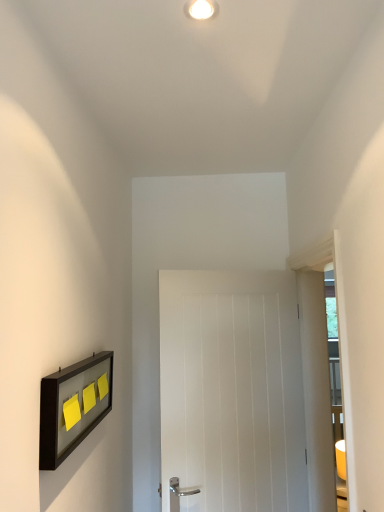
Measure the distance between point (198, 17) and camera.

They are 1.12 meters apart.

In order to face transparent glass door at right, should I rotate leftwards or rightwards?

To align with it, rotate right about 18.613°.

In order to face yellow matte/light switch at left, which is the 2th light switch in front-to-back order, should I rotate leftwards or rightwards?

You should look left and rotate roughly 13.251 degrees.

Where is `yellow matte/light switch at left, which is the 2th light switch in front-to-back order`? The height and width of the screenshot is (512, 384). yellow matte/light switch at left, which is the 2th light switch in front-to-back order is located at coordinates (89, 398).

Where is `white glossy light fixture at upper center`? The height and width of the screenshot is (512, 384). white glossy light fixture at upper center is located at coordinates (201, 9).

From the image's perspective, does transparent glass door at right appear higher than yellow matte paper at left, acting as the 2th light switch starting from the back?

Actually, transparent glass door at right appears below yellow matte paper at left, acting as the 2th light switch starting from the back, in the image.

Could you tell me if transparent glass door at right is facing yellow matte paper at left, acting as the 2th light switch starting from the back?

Yes, transparent glass door at right is turned towards yellow matte paper at left, acting as the 2th light switch starting from the back.

From a real-world perspective, between transparent glass door at right and yellow matte paper at left, positioned as the 1th light switch in front-to-back order, who is vertically higher?

yellow matte paper at left, positioned as the 1th light switch in front-to-back order.

Does point (265, 310) come closer to viewer compared to point (66, 431)?

No.

Is white wooden door at center situated inside matte black picture frame at left or outside?

white wooden door at center lies outside matte black picture frame at left.

From the image's perspective, is white wooden door at center positioned above or below matte black picture frame at left?

white wooden door at center is below matte black picture frame at left.

Does white wooden door at center touch matte black picture frame at left?

No, white wooden door at center is not making contact with matte black picture frame at left.

Is matte black picture frame at left bigger than yellow matte paper at left, positioned as the 1th light switch in front-to-back order?

Correct, matte black picture frame at left is larger in size than yellow matte paper at left, positioned as the 1th light switch in front-to-back order.

In order to click on the 2nd light switch above the matte black picture frame at left (from a real-world perspective) in this screenshot , I will do `click(71, 412)`.

Is matte black picture frame at left to the right of yellow matte paper at left, acting as the 2th light switch starting from the back, from the viewer's perspective?

In fact, matte black picture frame at left is to the left of yellow matte paper at left, acting as the 2th light switch starting from the back.

Which of these two, matte black picture frame at left or yellow matte paper at left, positioned as the 1th light switch in front-to-back order, is thinner?

Thinner between the two is yellow matte paper at left, positioned as the 1th light switch in front-to-back order.

Is yellow matte/light switch at left, which ranks as the 1th light switch in back-to-front order, to the left or to the right of matte black picture frame at left in the image?

From the image, it's evident that yellow matte/light switch at left, which ranks as the 1th light switch in back-to-front order, is to the right of matte black picture frame at left.

From their relative heights in the image, would you say yellow matte/light switch at left, which ranks as the 1th light switch in back-to-front order, is taller or shorter than matte black picture frame at left?

Clearly, yellow matte/light switch at left, which ranks as the 1th light switch in back-to-front order, is shorter compared to matte black picture frame at left.

Does yellow matte/light switch at left, which is the 2th light switch in front-to-back order, have a larger size compared to matte black picture frame at left?

No.

Can we say yellow matte/light switch at left, which ranks as the 1th light switch in back-to-front order, lies outside matte black picture frame at left?

Actually, yellow matte/light switch at left, which ranks as the 1th light switch in back-to-front order, is within matte black picture frame at left.

Who is shorter, yellow matte/light switch at left, which ranks as the 1th light switch in back-to-front order, or white wooden door at center?

With less height is yellow matte/light switch at left, which ranks as the 1th light switch in back-to-front order.

Which object is further away from the camera, yellow matte/light switch at left, which ranks as the 1th light switch in back-to-front order, or white wooden door at center?

white wooden door at center is more distant.

From the image's perspective, who appears lower, yellow matte/light switch at left, which is the 2th light switch in front-to-back order, or white wooden door at center?

From the image's view, white wooden door at center is below.

Between yellow matte/light switch at left, which ranks as the 1th light switch in back-to-front order, and white wooden door at center, which one has larger width?

Wider between the two is white wooden door at center.

How different are the orientations of white wooden door at center and yellow matte/light switch at left, which ranks as the 1th light switch in back-to-front order, in degrees?

They differ by 64.4 degrees in their facing directions.

In the scene shown: Is white wooden door at center positioned with its back to yellow matte/light switch at left, which is the 2th light switch in front-to-back order?

No, white wooden door at center is not facing the opposite direction of yellow matte/light switch at left, which is the 2th light switch in front-to-back order.

Could you measure the distance between white wooden door at center and yellow matte/light switch at left, which is the 2th light switch in front-to-back order?

white wooden door at center and yellow matte/light switch at left, which is the 2th light switch in front-to-back order, are 81.29 centimeters apart.

Considering the positions of point (244, 331) and point (84, 409), is point (244, 331) closer or farther from the camera than point (84, 409)?

Point (244, 331) appears to be farther away from the viewer than point (84, 409).

Is transparent glass door at right taller than yellow matte/light switch at left, which ranks as the 1th light switch in back-to-front order?

Indeed, transparent glass door at right has a greater height compared to yellow matte/light switch at left, which ranks as the 1th light switch in back-to-front order.

Is transparent glass door at right far away from yellow matte/light switch at left, which is the 2th light switch in front-to-back order?

Indeed, transparent glass door at right is not near yellow matte/light switch at left, which is the 2th light switch in front-to-back order.

In the image, is transparent glass door at right positioned in front of or behind yellow matte/light switch at left, which ranks as the 1th light switch in back-to-front order?

Clearly, transparent glass door at right is in front of yellow matte/light switch at left, which ranks as the 1th light switch in back-to-front order.

Is point (324, 466) closer or farther from the camera than point (83, 409)?

Point (324, 466) is farther from the camera than point (83, 409).

Locate an element on the screen. glass door located on the right of yellow matte paper at left, acting as the 2th light switch starting from the back is located at coordinates (319, 370).

Locate an element on the screen. The image size is (384, 512). door that appears below the matte black picture frame at left (from the image's perspective) is located at coordinates (232, 390).

Based on their spatial positions, is matte black picture frame at left or yellow matte/light switch at left, which is the 2th light switch in front-to-back order, closer to yellow matte paper at left, positioned as the 1th light switch in front-to-back order?

matte black picture frame at left.

Which object lies further to the anchor point transparent glass door at right, yellow matte/light switch at left, which is the 2th light switch in front-to-back order, or matte black picture frame at left?

Based on the image, yellow matte/light switch at left, which is the 2th light switch in front-to-back order, appears to be further to transparent glass door at right.

Which object lies nearer to the anchor point yellow matte paper at left, positioned as the 1th light switch in front-to-back order, white wooden door at center or white glossy light fixture at upper center?

white wooden door at center lies closer to yellow matte paper at left, positioned as the 1th light switch in front-to-back order, than the other object.

Which object lies nearer to the anchor point matte black picture frame at left, white glossy light fixture at upper center or yellow matte paper at left, acting as the 2th light switch starting from the back?

The object closer to matte black picture frame at left is yellow matte paper at left, acting as the 2th light switch starting from the back.

Which object lies nearer to the anchor point yellow matte/light switch at left, which ranks as the 1th light switch in back-to-front order, matte black picture frame at left or white glossy light fixture at upper center?

The object closer to yellow matte/light switch at left, which ranks as the 1th light switch in back-to-front order, is matte black picture frame at left.

Looking at the image, which one is located further to white glossy light fixture at upper center, matte black picture frame at left or transparent glass door at right?

Among the two, transparent glass door at right is located further to white glossy light fixture at upper center.

Estimate the real-world distances between objects in this image. Which object is closer to matte black picture frame at left, yellow matte paper at left, positioned as the 1th light switch in front-to-back order, or transparent glass door at right?

yellow matte paper at left, positioned as the 1th light switch in front-to-back order, is closer to matte black picture frame at left.

When comparing their distances from white wooden door at center, does white glossy light fixture at upper center or yellow matte paper at left, positioned as the 1th light switch in front-to-back order, seem closer?

yellow matte paper at left, positioned as the 1th light switch in front-to-back order, is positioned closer to the anchor white wooden door at center.

Identify the location of light switch located between matte black picture frame at left and yellow matte/light switch at left, which ranks as the 1th light switch in back-to-front order, in the depth direction. (71, 412).

Find the location of a particular element. The width and height of the screenshot is (384, 512). picture frame between white glossy light fixture at upper center and transparent glass door at right from top to bottom is located at coordinates (73, 406).

Where is `light switch that lies between white glossy light fixture at upper center and matte black picture frame at left from top to bottom`? light switch that lies between white glossy light fixture at upper center and matte black picture frame at left from top to bottom is located at coordinates (71, 412).

Image resolution: width=384 pixels, height=512 pixels. I want to click on light switch located between yellow matte paper at left, positioned as the 1th light switch in front-to-back order, and white wooden door at center in the left-right direction, so click(x=89, y=398).